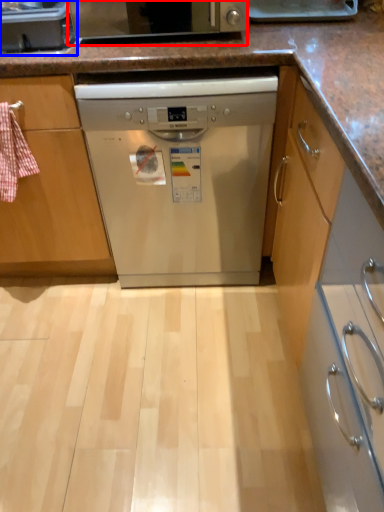
Question: Among these objects, which one is nearest to the camera, home appliance (highlighted by a red box) or kitchen appliance (highlighted by a blue box)?

Choices:
 (A) home appliance
 (B) kitchen appliance

Answer: (A)